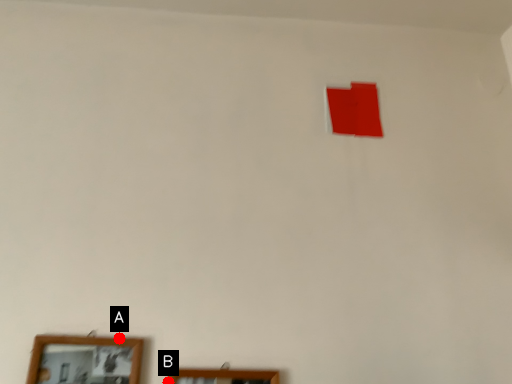
Question: Two points are circled on the image, labeled by A and B beside each circle. Which point appears closest to the camera in this image?

Choices:
 (A) A is closer
 (B) B is closer

Answer: (B)